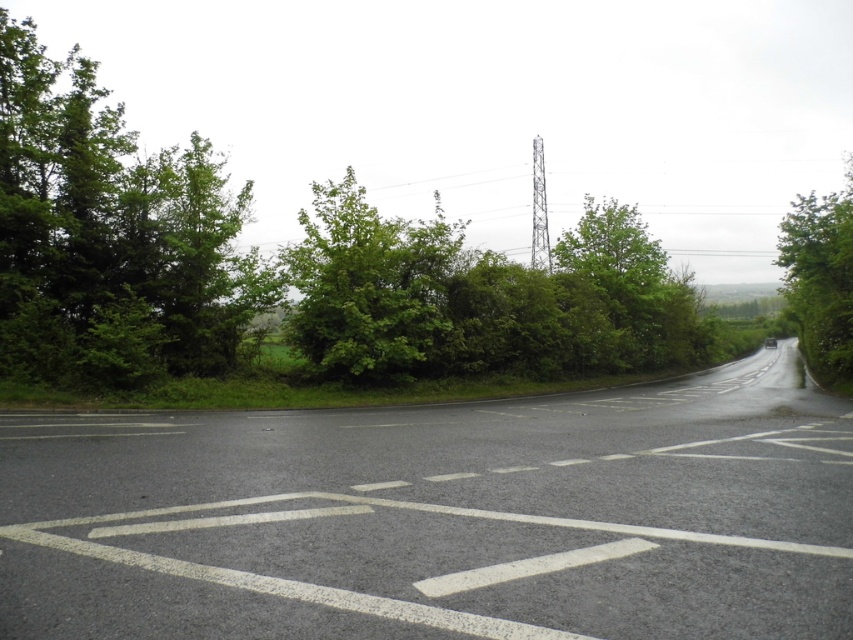
Question: Does green leafy tree at left appear over green leafy tree at right?

Choices:
 (A) yes
 (B) no

Answer: (A)

Question: Is green leafy tree at upper left thinner than green leafy bush at center?

Choices:
 (A) yes
 (B) no

Answer: (B)

Question: Based on their relative distances, which object is nearer to the green leafy tree at right?

Choices:
 (A) green leafy tree at upper left
 (B) green leafy bush at center
 (C) green leafy tree at left

Answer: (A)

Question: Estimate the real-world distances between objects in this image. Which object is closer to the green leafy tree at left?

Choices:
 (A) green leafy tree at upper left
 (B) green leafy bush at center

Answer: (A)

Question: Estimate the real-world distances between objects in this image. Which object is closer to the green leafy tree at right?

Choices:
 (A) green leafy tree at left
 (B) green leafy bush at center
 (C) green leafy tree at upper left

Answer: (C)

Question: Can you confirm if green leafy tree at upper left is bigger than green leafy bush at center?

Choices:
 (A) no
 (B) yes

Answer: (B)